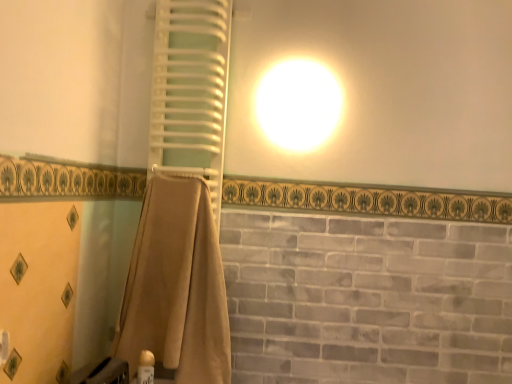
Question: Can you confirm if white plastic towel rack at upper left is thinner than beige fabric towel at center?

Choices:
 (A) no
 (B) yes

Answer: (B)

Question: Is white plastic towel rack at upper left placed right next to beige fabric towel at center?

Choices:
 (A) yes
 (B) no

Answer: (B)

Question: Is white plastic towel rack at upper left facing towards beige fabric towel at center?

Choices:
 (A) yes
 (B) no

Answer: (B)

Question: Would you say beige fabric towel at center is part of white plastic towel rack at upper left's contents?

Choices:
 (A) yes
 (B) no

Answer: (B)

Question: From the image's perspective, does white plastic towel rack at upper left appear higher than beige fabric towel at center?

Choices:
 (A) no
 (B) yes

Answer: (B)

Question: Considering the relative sizes of white plastic towel rack at upper left and beige fabric towel at center in the image provided, is white plastic towel rack at upper left taller than beige fabric towel at center?

Choices:
 (A) no
 (B) yes

Answer: (B)

Question: Is beige fabric towel at center taller than white plastic towel rack at upper left?

Choices:
 (A) yes
 (B) no

Answer: (B)

Question: Considering the relative sizes of beige fabric towel at center and white plastic towel rack at upper left in the image provided, is beige fabric towel at center wider than white plastic towel rack at upper left?

Choices:
 (A) yes
 (B) no

Answer: (A)

Question: Can you confirm if beige fabric towel at center is smaller than white plastic towel rack at upper left?

Choices:
 (A) no
 (B) yes

Answer: (A)

Question: Is beige fabric towel at center far away from white plastic towel rack at upper left?

Choices:
 (A) no
 (B) yes

Answer: (A)

Question: From the image's perspective, is beige fabric towel at center under white plastic towel rack at upper left?

Choices:
 (A) no
 (B) yes

Answer: (B)

Question: Considering the relative sizes of beige fabric towel at center and white plastic towel rack at upper left in the image provided, is beige fabric towel at center bigger than white plastic towel rack at upper left?

Choices:
 (A) no
 (B) yes

Answer: (B)

Question: From a real-world perspective, is white plastic towel rack at upper left under gold plastic can at lower left?

Choices:
 (A) no
 (B) yes

Answer: (A)